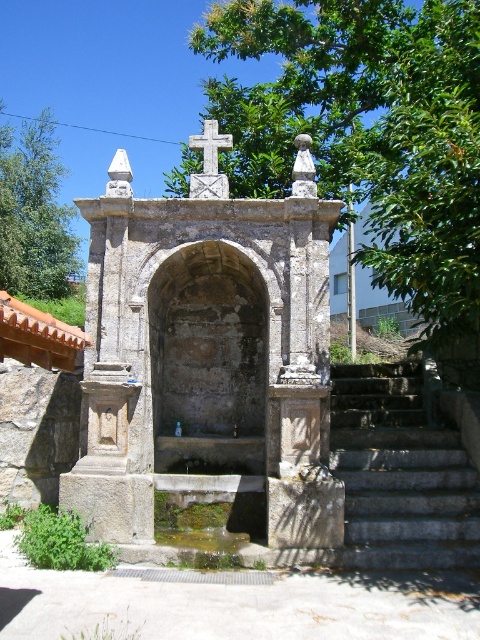
From the picture: You are standing in front of the old stone fountain and want to take a photo that includes both the green leafy tree at upper center and the white stone cross at center. Which object should you focus on first to ensure both are in clear view?

You should focus on the green leafy tree at upper center first because it is closer to the viewer than the white stone cross at center, so adjusting focus from near to far will help both be in clear view.

You are standing in front of the old stone fountain and want to take a photo that includes both the green leafy tree at upper center and the gray stone stairs at lower right. Which object will appear larger in the photo?

The green leafy tree at upper center will appear larger in the photo because it is much taller than the gray stone stairs at lower right.